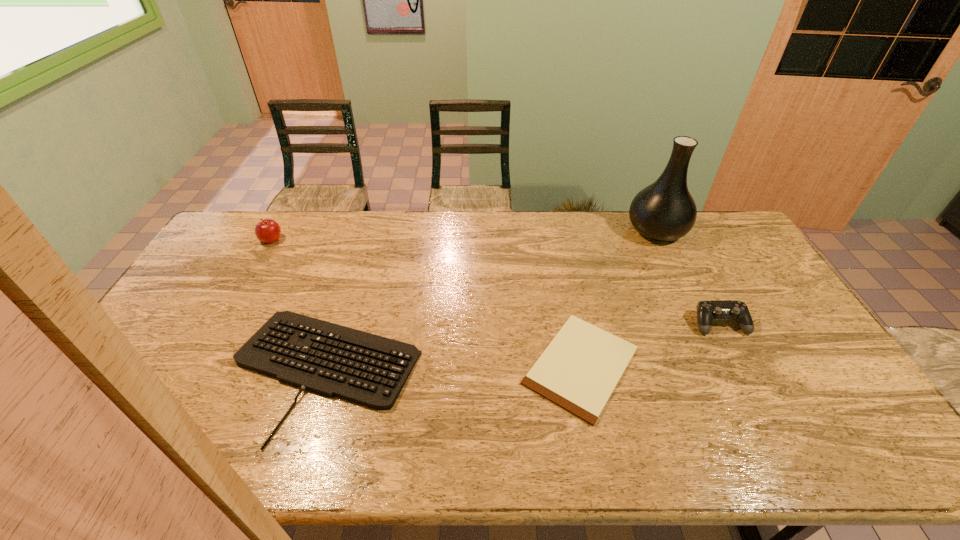
Image resolution: width=960 pixels, height=540 pixels. In order to click on vase in this screenshot , I will do `click(664, 211)`.

Locate an element on the screen. The height and width of the screenshot is (540, 960). the leftmost object is located at coordinates (268, 231).

Locate an element on the screen. This screenshot has width=960, height=540. apple is located at coordinates (268, 231).

Find the location of a particular element. The height and width of the screenshot is (540, 960). control is located at coordinates (707, 311).

I want to click on the fourth tallest object, so click(x=329, y=359).

Where is `computer keyboard`? This screenshot has width=960, height=540. computer keyboard is located at coordinates pyautogui.click(x=329, y=359).

At what (x,y) coordinates should I click in order to perform the action: click on the shortest object. Please return your answer as a coordinate pair (x, y). The image size is (960, 540). Looking at the image, I should click on (578, 371).

Identify the location of the third object from right to left. The image size is (960, 540). (578, 371).

Find the location of a particular element. blank area located 0.130m on the front of the tallest object is located at coordinates [678, 274].

This screenshot has width=960, height=540. What are the coordinates of `free space located on the right of the leftmost object` in the screenshot? It's located at (393, 240).